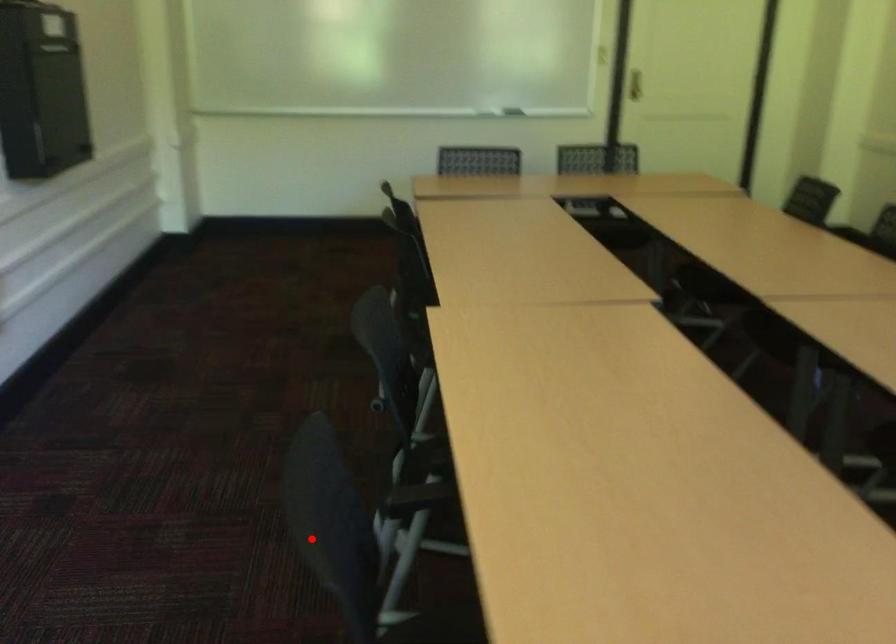
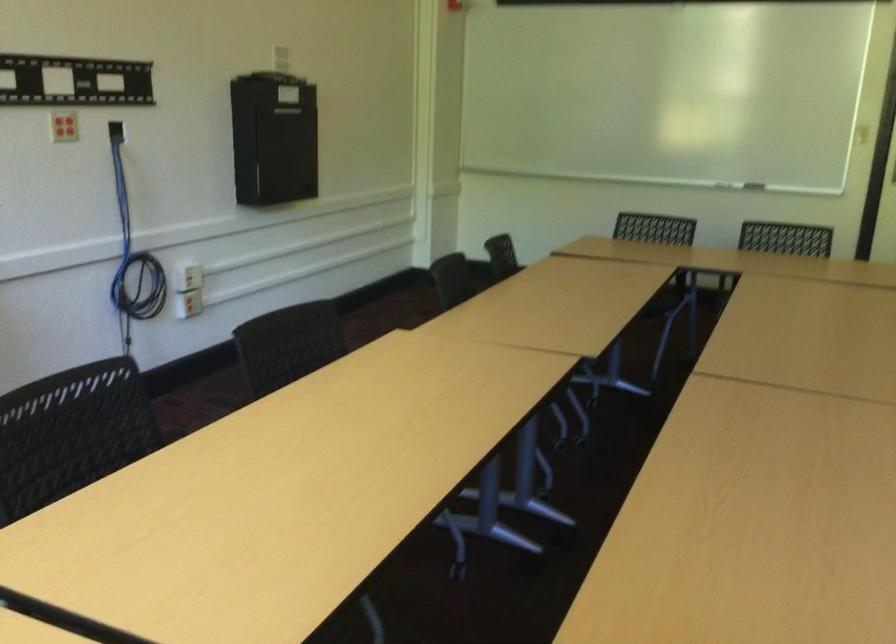
Find the pixel in the second image that matches the highlighted location in the first image.

(71, 433)